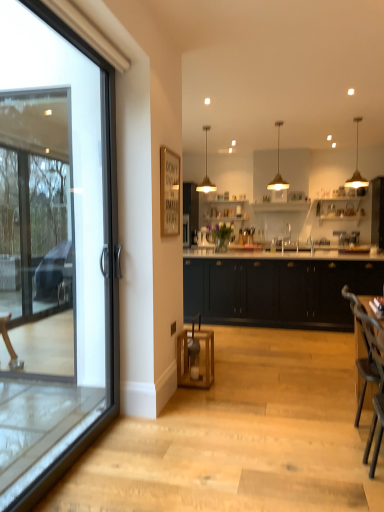
Identify the location of wooden bar stool at center. This screenshot has width=384, height=512. (195, 356).

What is the approximate width of matte gold pendant light at upper center, which appears as the 2th lamp when viewed from the right?

12.31 inches.

Locate an element on the screen. This screenshot has width=384, height=512. wooden bar stool at center is located at coordinates (195, 356).

Between gold metallic pendant light at upper center, which is the 1th lamp in left-to-right order, and wooden bar stool at center, which one has less height?

Standing shorter between the two is wooden bar stool at center.

How many degrees apart are the facing directions of gold metallic pendant light at upper center, acting as the third lamp starting from the right, and wooden bar stool at center?

85.4 degrees.

Does gold metallic pendant light at upper center, which is the 1th lamp in left-to-right order, have a lesser width compared to wooden bar stool at center?

No.

Are gold metallic pendant light at upper center, which is the 1th lamp in left-to-right order, and wooden bar stool at center located far from each other?

That's right, there is a large distance between gold metallic pendant light at upper center, which is the 1th lamp in left-to-right order, and wooden bar stool at center.

Who is bigger, wooden bar stool at center or gold metallic pendant light at upper right, positioned as the first lamp in right-to-left order?

gold metallic pendant light at upper right, positioned as the first lamp in right-to-left order, is bigger.

Considering the positions of objects wooden bar stool at center and gold metallic pendant light at upper right, positioned as the first lamp in right-to-left order, in the image provided, who is more to the left, wooden bar stool at center or gold metallic pendant light at upper right, positioned as the first lamp in right-to-left order,?

From the viewer's perspective, wooden bar stool at center appears more on the left side.

Is gold metallic pendant light at upper right, positioned as the first lamp in right-to-left order, completely or partially inside wooden bar stool at center?

No, gold metallic pendant light at upper right, positioned as the first lamp in right-to-left order, is located outside of wooden bar stool at center.

Is black matte cabinetry at center oriented towards gold metallic pendant light at upper right, positioned as the first lamp in right-to-left order?

No.

Which is closer to the camera, (323, 306) or (352, 178)?

The point (323, 306) is closer to the camera.

Is black matte cabinetry at center to the left of gold metallic pendant light at upper right, positioned as the first lamp in right-to-left order, from the viewer's perspective?

Yes, black matte cabinetry at center is to the left of gold metallic pendant light at upper right, positioned as the first lamp in right-to-left order.

Is wooden bar stool at center positioned beyond the bounds of matte gold pendant light at upper center, which ranks as the second lamp in left-to-right order?

Yes, wooden bar stool at center is located beyond the bounds of matte gold pendant light at upper center, which ranks as the second lamp in left-to-right order.

From a real-world perspective, is wooden bar stool at center beneath matte gold pendant light at upper center, which appears as the 2th lamp when viewed from the right?

Correct, in the physical world, wooden bar stool at center is lower than matte gold pendant light at upper center, which appears as the 2th lamp when viewed from the right.

In the scene shown: Can you confirm if wooden bar stool at center is positioned to the right of matte gold pendant light at upper center, which ranks as the second lamp in left-to-right order?

In fact, wooden bar stool at center is to the left of matte gold pendant light at upper center, which ranks as the second lamp in left-to-right order.

Can you see wooden bar stool at center touching matte gold pendant light at upper center, which ranks as the second lamp in left-to-right order?

No, wooden bar stool at center is not beside matte gold pendant light at upper center, which ranks as the second lamp in left-to-right order.

Which is in front, gold metallic pendant light at upper right, positioned as the first lamp in right-to-left order, or gold metallic pendant light at upper center, which is the 1th lamp in left-to-right order?

gold metallic pendant light at upper right, positioned as the first lamp in right-to-left order, is closer to the camera.

From a real-world perspective, which object stands above the other?

gold metallic pendant light at upper center, which is the 1th lamp in left-to-right order, is physically above.

Is gold metallic pendant light at upper right, positioned as the first lamp in right-to-left order, oriented towards gold metallic pendant light at upper center, which is the 1th lamp in left-to-right order?

No, gold metallic pendant light at upper right, positioned as the first lamp in right-to-left order, is not turned towards gold metallic pendant light at upper center, which is the 1th lamp in left-to-right order.

Is point (357, 126) closer or farther from the camera than point (215, 186)?

Clearly, point (357, 126) is closer to the camera than point (215, 186).

From a real-world perspective, is gold metallic pendant light at upper right, positioned as the first lamp in right-to-left order, positioned above or below matte gold pendant light at upper center, which appears as the 2th lamp when viewed from the right?

gold metallic pendant light at upper right, positioned as the first lamp in right-to-left order, is above matte gold pendant light at upper center, which appears as the 2th lamp when viewed from the right.

Is gold metallic pendant light at upper right, the third lamp in the left-to-right sequence, oriented away from matte gold pendant light at upper center, which ranks as the second lamp in left-to-right order?

gold metallic pendant light at upper right, the third lamp in the left-to-right sequence, is not turned away from matte gold pendant light at upper center, which ranks as the second lamp in left-to-right order.

Which object is more forward, gold metallic pendant light at upper right, positioned as the first lamp in right-to-left order, or matte gold pendant light at upper center, which appears as the 2th lamp when viewed from the right?

gold metallic pendant light at upper right, positioned as the first lamp in right-to-left order.

Is gold metallic pendant light at upper right, the third lamp in the left-to-right sequence, bigger than wooden armchair at right?

Actually, gold metallic pendant light at upper right, the third lamp in the left-to-right sequence, might be smaller than wooden armchair at right.

Is gold metallic pendant light at upper right, the third lamp in the left-to-right sequence, in contact with wooden armchair at right?

No, gold metallic pendant light at upper right, the third lamp in the left-to-right sequence, is not touching wooden armchair at right.

In the scene shown: Between gold metallic pendant light at upper right, the third lamp in the left-to-right sequence, and wooden armchair at right, which one appears on the right side from the viewer's perspective?

gold metallic pendant light at upper right, the third lamp in the left-to-right sequence, is more to the right.

Which is behind, point (356, 121) or point (362, 370)?

Positioned behind is point (356, 121).

The height and width of the screenshot is (512, 384). Find the location of `the 1st lamp counting from the right of the wooden bar stool at center`. the 1st lamp counting from the right of the wooden bar stool at center is located at coordinates (206, 172).

Where is `the 1st lamp above the wooden bar stool at center (from the image's perspective)`? the 1st lamp above the wooden bar stool at center (from the image's perspective) is located at coordinates 356,167.

When comparing their distances from matte gold pendant light at upper center, which ranks as the second lamp in left-to-right order, does black matte cabinetry at center or gold metallic pendant light at upper right, positioned as the first lamp in right-to-left order, seem further?

black matte cabinetry at center is positioned further to the anchor matte gold pendant light at upper center, which ranks as the second lamp in left-to-right order.

Looking at the image, which one is located further to wooden armchair at right, gold metallic pendant light at upper right, the third lamp in the left-to-right sequence, or gold metallic pendant light at upper center, acting as the third lamp starting from the right?

Based on the image, gold metallic pendant light at upper center, acting as the third lamp starting from the right, appears to be further to wooden armchair at right.

Considering their positions, is matte gold pendant light at upper center, which appears as the 2th lamp when viewed from the right, positioned closer to gold metallic pendant light at upper center, acting as the third lamp starting from the right, than wooden bar stool at center?

matte gold pendant light at upper center, which appears as the 2th lamp when viewed from the right, is positioned closer to the anchor gold metallic pendant light at upper center, acting as the third lamp starting from the right.

Based on their spatial positions, is black matte cabinetry at center or gold metallic pendant light at upper right, positioned as the first lamp in right-to-left order, further from wooden armchair at right?

gold metallic pendant light at upper right, positioned as the first lamp in right-to-left order.

Estimate the real-world distances between objects in this image. Which object is closer to wooden bar stool at center, black matte cabinetry at center or wooden armchair at right?

wooden armchair at right is positioned closer to the anchor wooden bar stool at center.

Which object lies nearer to the anchor point matte gold pendant light at upper center, which appears as the 2th lamp when viewed from the right, wooden bar stool at center or gold metallic pendant light at upper right, positioned as the first lamp in right-to-left order?

gold metallic pendant light at upper right, positioned as the first lamp in right-to-left order.

When comparing their distances from wooden armchair at right, does matte gold pendant light at upper center, which appears as the 2th lamp when viewed from the right, or gold metallic pendant light at upper right, the third lamp in the left-to-right sequence, seem further?

Among the two, matte gold pendant light at upper center, which appears as the 2th lamp when viewed from the right, is located further to wooden armchair at right.

Which object lies further to the anchor point gold metallic pendant light at upper center, which is the 1th lamp in left-to-right order, wooden armchair at right or gold metallic pendant light at upper right, the third lamp in the left-to-right sequence?

wooden armchair at right lies further to gold metallic pendant light at upper center, which is the 1th lamp in left-to-right order, than the other object.

Where is `lamp between wooden armchair at right and matte gold pendant light at upper center, which ranks as the second lamp in left-to-right order, from front to back`? lamp between wooden armchair at right and matte gold pendant light at upper center, which ranks as the second lamp in left-to-right order, from front to back is located at coordinates (356, 167).

Locate an element on the screen. cabinetry located between wooden armchair at right and matte gold pendant light at upper center, which appears as the 2th lamp when viewed from the right, in the depth direction is located at coordinates (277, 291).

The image size is (384, 512). I want to click on cabinetry between wooden armchair at right and gold metallic pendant light at upper right, positioned as the first lamp in right-to-left order, along the z-axis, so click(277, 291).

Locate an element on the screen. cabinetry between wooden bar stool at center and matte gold pendant light at upper center, which appears as the 2th lamp when viewed from the right, from front to back is located at coordinates (277, 291).